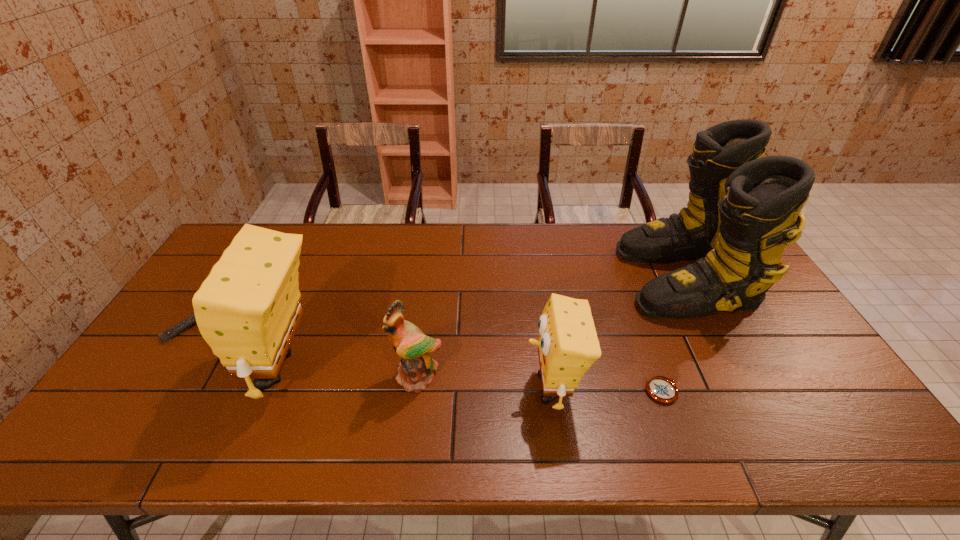
This screenshot has height=540, width=960. I want to click on vacant region that satisfies the following two spatial constraints: 1. on the front side of the tallest object; 2. on the face of the fifth object from right to left, so click(732, 368).

I want to click on free location that satisfies the following two spatial constraints: 1. on the front side of the ski boots; 2. on the face of the right sponge, so click(x=743, y=388).